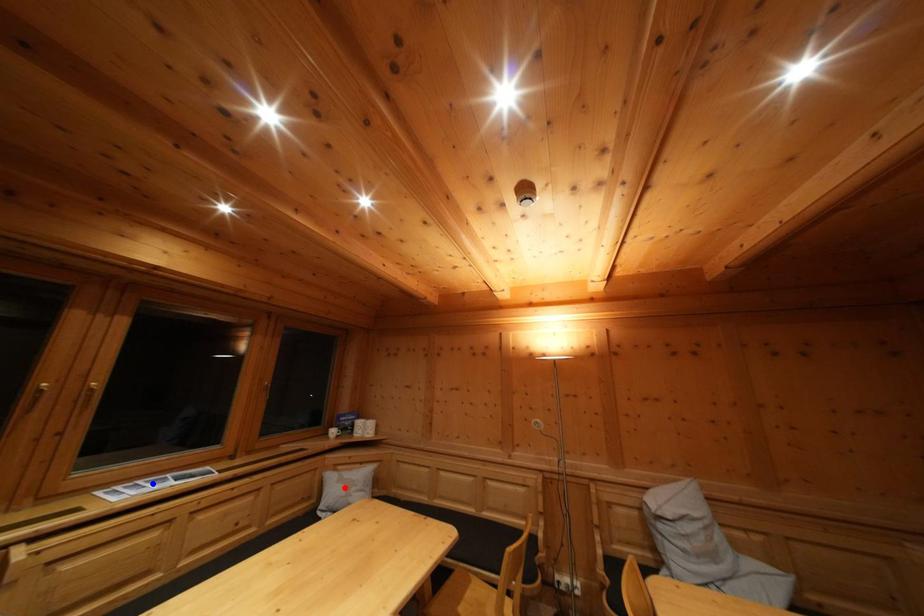
Question: Two points are marked on the image. Which point is closer to the camera?

Choices:
 (A) Blue point is closer.
 (B) Red point is closer.

Answer: (A)